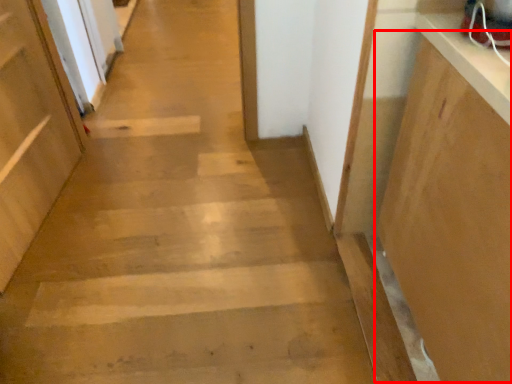
Question: From the image's perspective, considering the relative positions of cabinetry (annotated by the red box) and door in the image provided, where is cabinetry (annotated by the red box) located with respect to the staircase?

Choices:
 (A) below
 (B) above

Answer: (A)